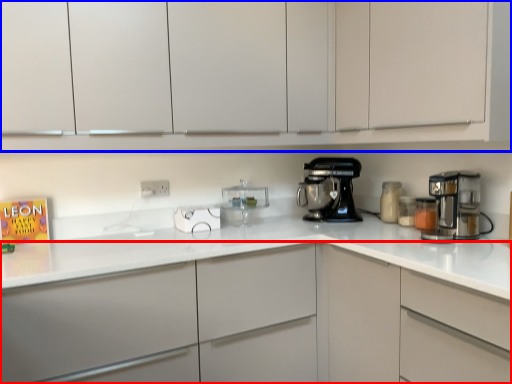
Question: Among these objects, which one is farthest to the camera, cabinetry (highlighted by a red box) or cabinetry (highlighted by a blue box)?

Choices:
 (A) cabinetry
 (B) cabinetry

Answer: (A)